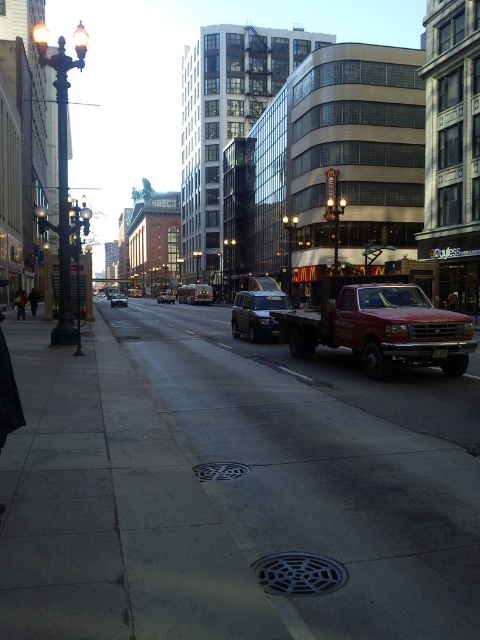
You are standing on the sidewalk in the urban street scene. You notice two points marked on the ground. One is at coordinate point (226, 465) and the other is at point (160, 300). Which point is closer to you?

Point (226, 465) is closer to the viewer than point (160, 300).

In the scene shown: You are standing at the point labeled as point (380, 326) in the image. Looking around, you see a red matte truck at right. Which direction should you face to see the red matte truck at right?

You should face to the right to see the red matte truck at right since the point (380, 326) is located at the right side of the image where the truck is positioned.

You are a pedestrian standing on the sidewalk and want to cross the street to reach a store across the street. You see a red matte truck at right and a matte black van at center. Which vehicle is closer to the sidewalk where you are standing?

The red matte truck at right is positioned under the matte black van at center, meaning it is closer to the sidewalk where you are standing.